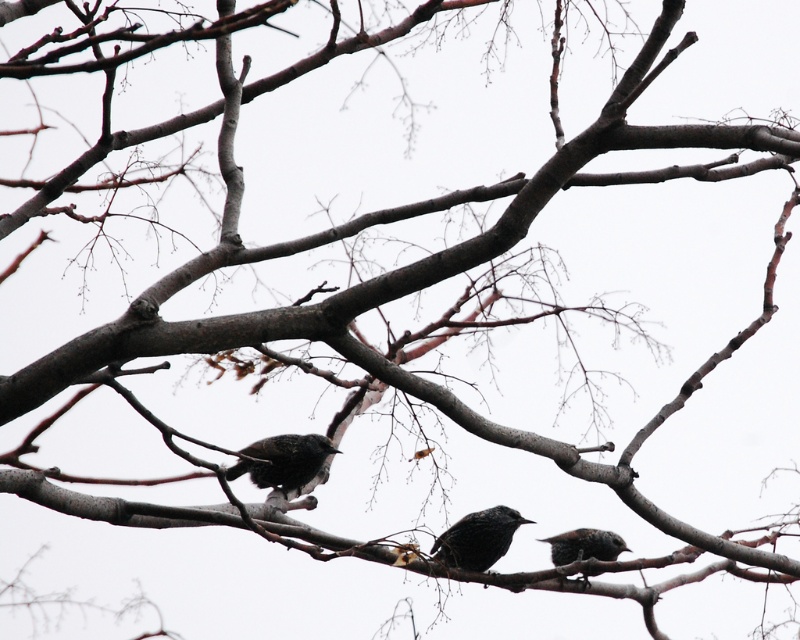
Can you confirm if dark gray feathers at center is positioned to the right of dark gray speckled bird at lower right?

In fact, dark gray feathers at center is to the left of dark gray speckled bird at lower right.

Is dark gray feathers at center taller than dark gray speckled bird at lower right?

Correct, dark gray feathers at center is much taller as dark gray speckled bird at lower right.

Is point (484, 550) positioned behind point (556, 547)?

No, it is in front of (556, 547).

Locate an element on the screen. The width and height of the screenshot is (800, 640). dark gray feathers at center is located at coordinates (478, 538).

Does dark brown speckled bird at center appear on the left side of dark gray feathers at center?

Correct, you'll find dark brown speckled bird at center to the left of dark gray feathers at center.

Is point (278, 435) positioned in front of point (448, 556)?

No, (278, 435) is further to viewer.

Where is `dark brown speckled bird at center`? dark brown speckled bird at center is located at coordinates [284, 460].

You are a GUI agent. You are given a task and a screenshot of the screen. Output one action in this format:
    pyautogui.click(x=<x>, y=<y>)
    Task: Click on the dark brown speckled bird at center
    This screenshot has width=800, height=640.
    Given the screenshot: What is the action you would take?
    pyautogui.click(x=284, y=460)

Does dark brown speckled bird at center have a greater height compared to dark gray speckled bird at lower right?

Yes.

What are the coordinates of `dark brown speckled bird at center` in the screenshot? It's located at point(284,460).

In order to click on dark brown speckled bird at center in this screenshot , I will do `click(284, 460)`.